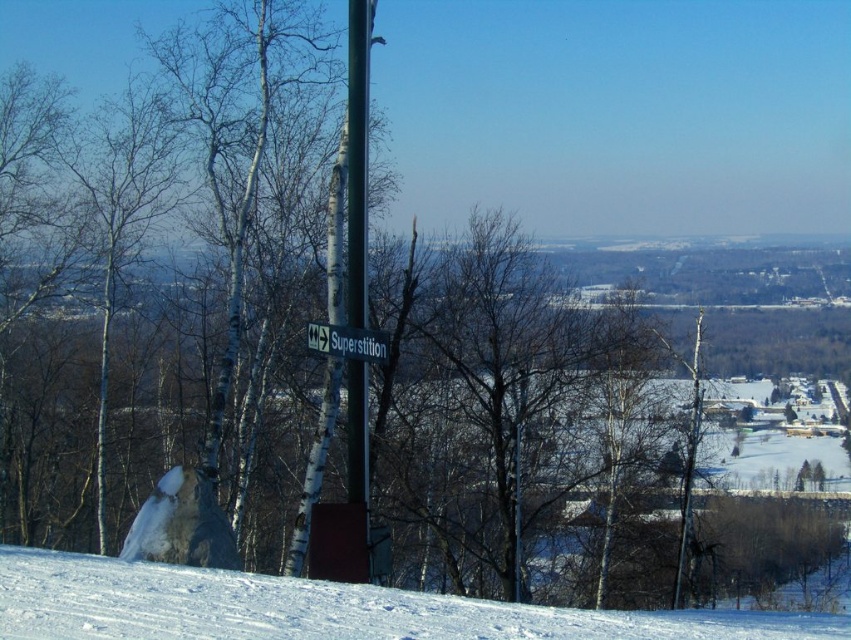
Question: Is white powdery snow at lower center further to camera compared to white plastic street sign at center?

Choices:
 (A) no
 (B) yes

Answer: (A)

Question: Which object appears farthest from the camera in this image?

Choices:
 (A) white plastic street sign at center
 (B) white powdery snow at lower center

Answer: (A)

Question: Does white powdery snow at lower center appear on the right side of white plastic street sign at center?

Choices:
 (A) no
 (B) yes

Answer: (B)

Question: Is the position of white powdery snow at lower center less distant than that of white plastic street sign at center?

Choices:
 (A) no
 (B) yes

Answer: (B)

Question: Which object appears farthest from the camera in this image?

Choices:
 (A) white plastic street sign at center
 (B) white powdery snow at lower center

Answer: (A)